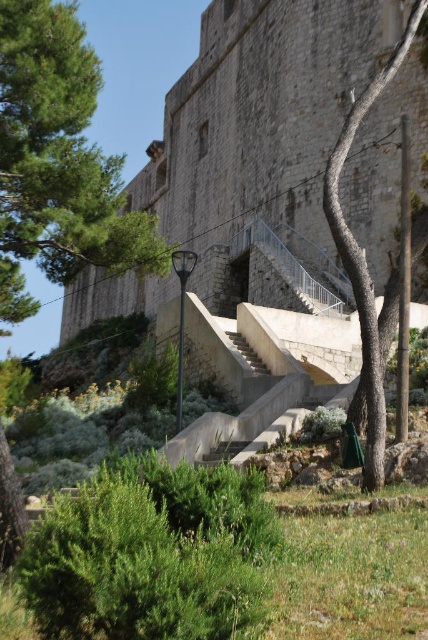
Question: Is green leafy tree at upper left smaller than smooth concrete stairs at center?

Choices:
 (A) no
 (B) yes

Answer: (A)

Question: Which object is farther from the camera taking this photo?

Choices:
 (A) green leafy tree at upper left
 (B) green leafy tree at center

Answer: (A)

Question: Among these points, which one is nearest to the camera?

Choices:
 (A) (353, 125)
 (B) (0, 250)

Answer: (A)

Question: Which point is farther to the camera?

Choices:
 (A) (262, 365)
 (B) (368, 461)

Answer: (A)

Question: Is green leafy tree at upper left below smooth concrete stairs at center?

Choices:
 (A) yes
 (B) no

Answer: (B)

Question: Considering the relative positions of green leafy tree at upper left and smooth concrete stairs at center in the image provided, where is green leafy tree at upper left located with respect to smooth concrete stairs at center?

Choices:
 (A) right
 (B) left

Answer: (B)